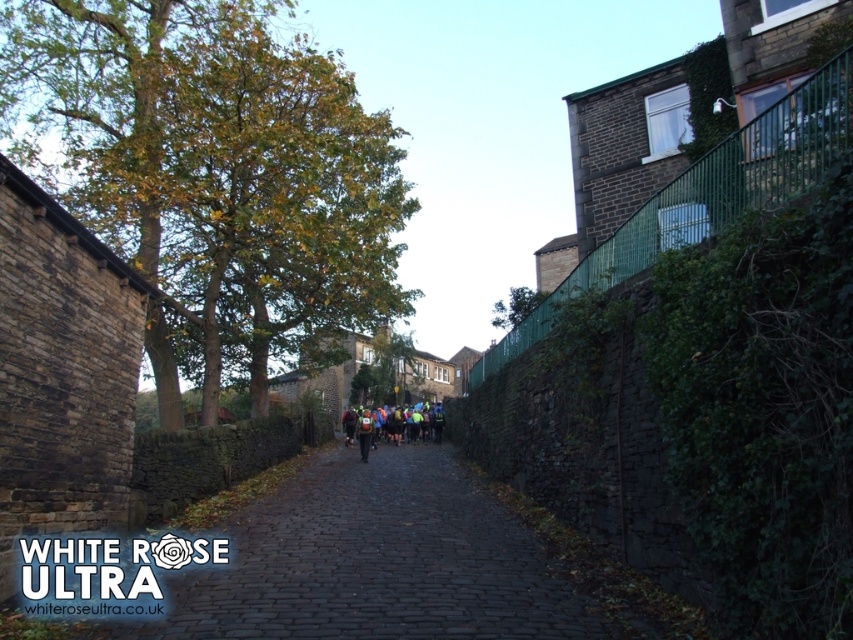
You are a runner participating in an event and see the dark cobblestone path at center and the reflective yellow jacket at center. Which object is closer to your right side?

The dark cobblestone path at center is to the right of the reflective yellow jacket at center, so the dark cobblestone path at center is closer to your right side.

You are standing at the starting point of a race on the cobblestone path. You need to reach the finish line. The starting point is at point (x=250, y=557) and the finish line is at point (x=364, y=456). Which direction should you move to reach the finish line?

Since point (x=250, y=557) is in front of point (x=364, y=456), you should move backward to reach the finish line.